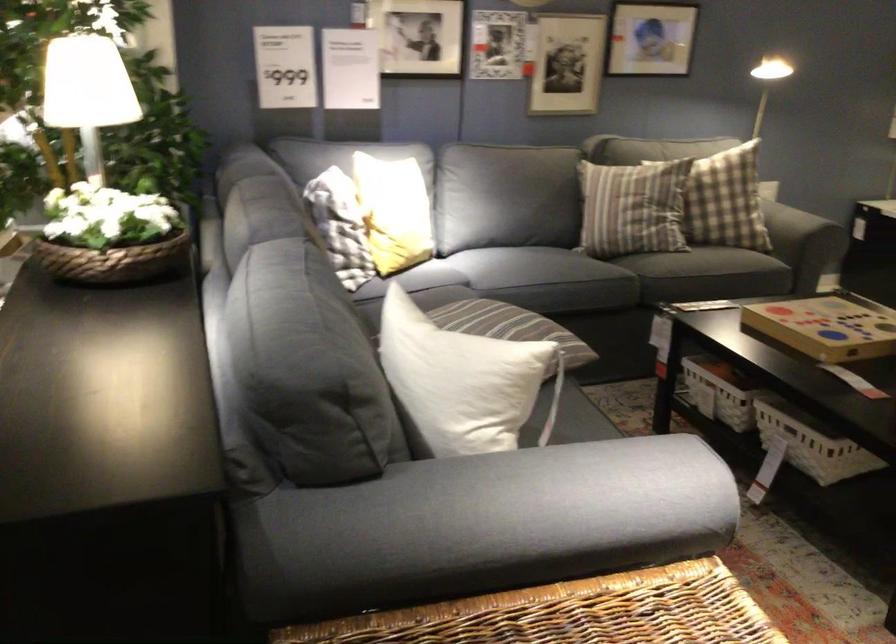
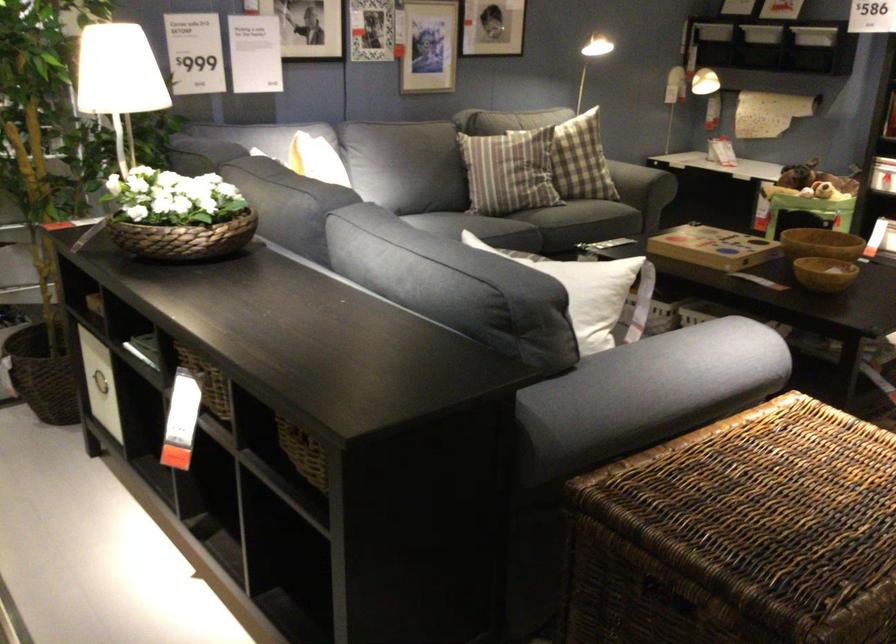
Question: I am providing you with two images of the same scene from different viewpoints. After the viewpoint changes to image2, which objects are now occluded?

Choices:
 (A) white box handle
 (B) green whiteboard marker
 (C) gray sofa armrest
 (D) yellow throw pillow

Answer: (D)